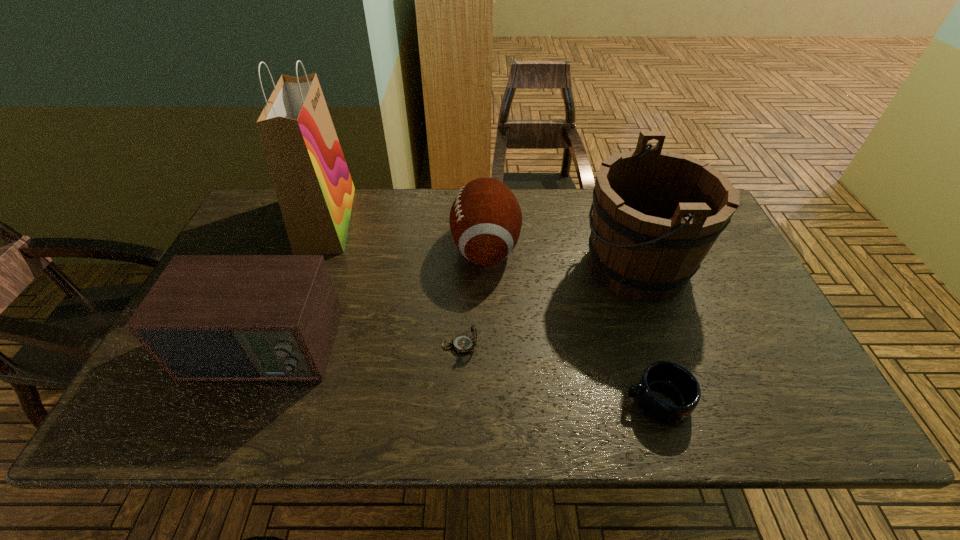
This screenshot has height=540, width=960. What are the coordinates of `free space at the near left corner of the desktop` in the screenshot? It's located at (199, 402).

Where is `vacant space at the near right corner of the desktop`? vacant space at the near right corner of the desktop is located at coordinates (780, 419).

Find the location of `free space between the mug and the radio receiver`. free space between the mug and the radio receiver is located at coordinates (460, 375).

The width and height of the screenshot is (960, 540). I want to click on free point between the radio receiver and the football, so click(373, 298).

You are a GUI agent. You are given a task and a screenshot of the screen. Output one action in this format:
    pyautogui.click(x=<x>, y=<y>)
    Task: Click on the free space between the football and the shopping bag
    This screenshot has width=960, height=540.
    Given the screenshot: What is the action you would take?
    pyautogui.click(x=406, y=233)

The image size is (960, 540). Find the location of `free space between the tallest object and the compass`. free space between the tallest object and the compass is located at coordinates (394, 282).

You are a GUI agent. You are given a task and a screenshot of the screen. Output one action in this format:
    pyautogui.click(x=<x>, y=<y>)
    Task: Click on the vacant area that lies between the radio receiver and the wine bucket
    Image resolution: width=960 pixels, height=540 pixels.
    Given the screenshot: What is the action you would take?
    pyautogui.click(x=450, y=307)

Identify the location of free space between the football and the mug. (571, 324).

You are a GUI agent. You are given a task and a screenshot of the screen. Output one action in this format:
    pyautogui.click(x=<x>, y=<y>)
    Task: Click on the free point between the radio receiver and the football
    The width and height of the screenshot is (960, 540).
    Given the screenshot: What is the action you would take?
    pyautogui.click(x=373, y=298)

Where is `vacant point located between the compass and the shopping bag`? The image size is (960, 540). vacant point located between the compass and the shopping bag is located at coordinates (394, 282).